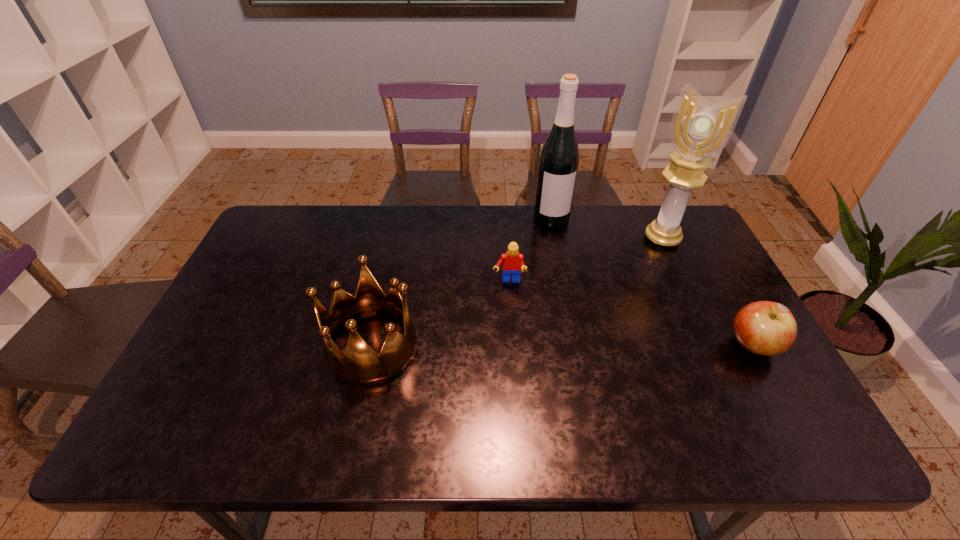
Locate an element on the screen. This screenshot has height=540, width=960. free space located 0.310m on the label of the third object from right to left is located at coordinates (571, 295).

Image resolution: width=960 pixels, height=540 pixels. In order to click on free space located on the label of the third object from right to left in this screenshot , I will do `click(569, 288)`.

This screenshot has width=960, height=540. What are the coordinates of `vacant space located on the front-facing side of the Lego` in the screenshot? It's located at (511, 399).

The image size is (960, 540). Identify the location of free spot located 0.260m on the front-facing side of the Lego. (510, 360).

Where is `vacant area located 0.110m on the front-facing side of the Lego`? The height and width of the screenshot is (540, 960). vacant area located 0.110m on the front-facing side of the Lego is located at coordinates (510, 315).

I want to click on free space located on the front-facing side of the award, so click(x=608, y=325).

I want to click on free region located 0.290m on the front-facing side of the award, so click(620, 304).

You are a GUI agent. You are given a task and a screenshot of the screen. Output one action in this format:
    pyautogui.click(x=<x>, y=<y>)
    Task: Click on the blank space located 0.140m on the front-facing side of the award
    This screenshot has height=540, width=960.
    Given the screenshot: What is the action you would take?
    pyautogui.click(x=638, y=274)

The width and height of the screenshot is (960, 540). In order to click on wine bottle present at the far edge in this screenshot , I will do `click(559, 158)`.

Where is `award at the far edge`? This screenshot has height=540, width=960. award at the far edge is located at coordinates (698, 130).